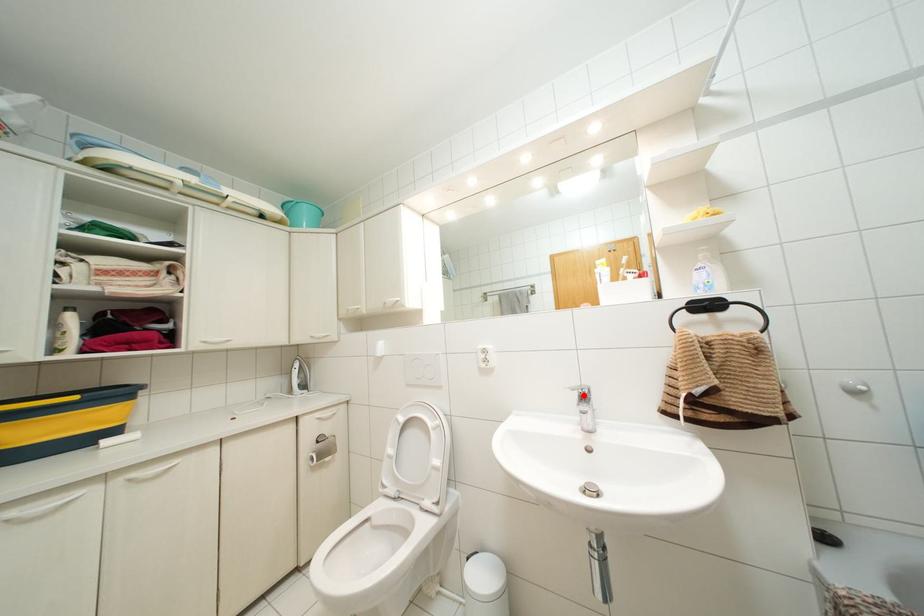
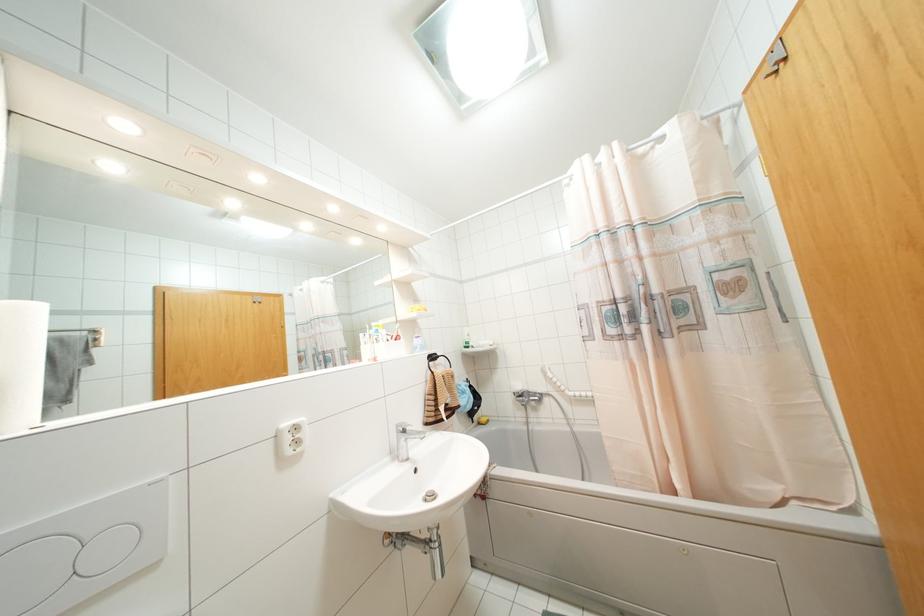
In the second image, find the point that corresponds to the highlighted location in the first image.

(404, 431)